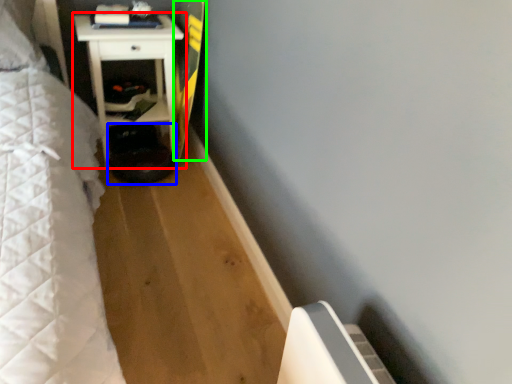
Question: Considering the real-world distances, which object is farthest from furniture (highlighted by a red box)? step stool (highlighted by a blue box) or longboard (highlighted by a green box)?

Choices:
 (A) step stool
 (B) longboard

Answer: (A)